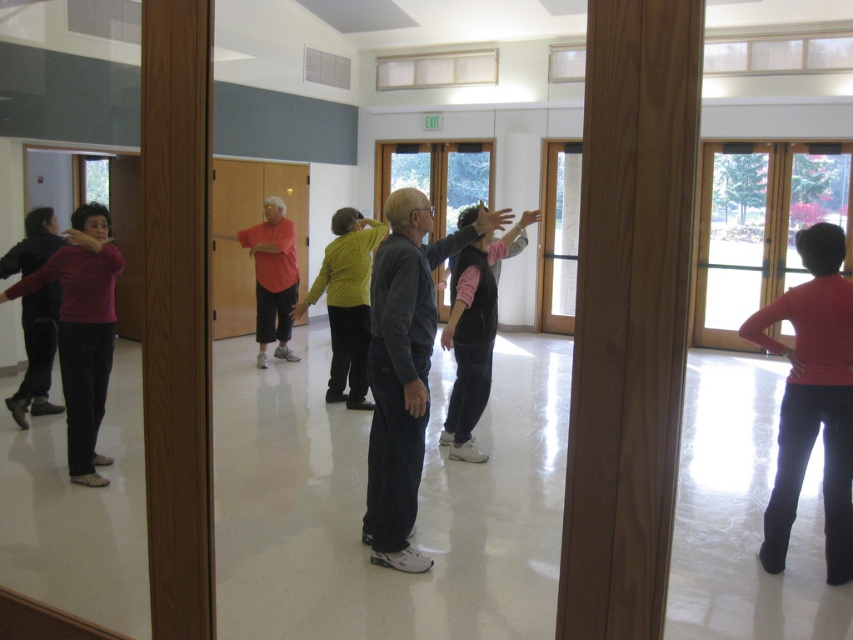
Which is behind, point (399, 380) or point (106, 241)?

Positioned behind is point (106, 241).

This screenshot has width=853, height=640. In order to click on dark gray sweater at center in this screenshot , I will do `click(404, 369)`.

Does velvet black vest at center have a greater width compared to matte black sweater at left?

Yes.

Does velvet black vest at center appear under matte black sweater at left?

Indeed, velvet black vest at center is positioned under matte black sweater at left.

Where is `velvet black vest at center`? velvet black vest at center is located at coordinates (474, 337).

Who is positioned more to the right, matte red sweater at right or pink fabric shirt at center?

matte red sweater at right is more to the right.

From the picture: Is matte red sweater at right bigger than pink fabric shirt at center?

Yes, matte red sweater at right is bigger than pink fabric shirt at center.

What do you see at coordinates (811, 400) in the screenshot?
I see `matte red sweater at right` at bounding box center [811, 400].

Identify the location of matte red sweater at right. (811, 400).